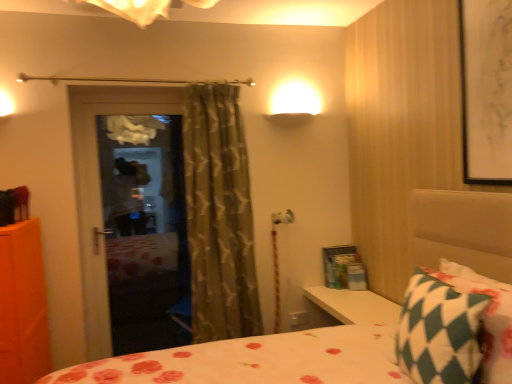
Question: From a real-world perspective, does green textured curtain at center sit lower than white paper at upper right?

Choices:
 (A) yes
 (B) no

Answer: (A)

Question: Can you confirm if green textured curtain at center is taller than white paper at upper right?

Choices:
 (A) no
 (B) yes

Answer: (B)

Question: From the image's perspective, is green textured curtain at center below white paper at upper right?

Choices:
 (A) no
 (B) yes

Answer: (B)

Question: Considering the relative positions of green textured curtain at center and white paper at upper right in the image provided, is green textured curtain at center to the right of white paper at upper right from the viewer's perspective?

Choices:
 (A) yes
 (B) no

Answer: (B)

Question: Does green textured curtain at center touch white paper at upper right?

Choices:
 (A) no
 (B) yes

Answer: (A)

Question: Considering the relative positions of green textured curtain at center and white paper at upper right in the image provided, is green textured curtain at center behind white paper at upper right?

Choices:
 (A) yes
 (B) no

Answer: (A)

Question: Considering the relative sizes of green checkered pillow at lower right and white paper at upper right in the image provided, is green checkered pillow at lower right wider than white paper at upper right?

Choices:
 (A) no
 (B) yes

Answer: (B)

Question: Is green checkered pillow at lower right looking in the opposite direction of white paper at upper right?

Choices:
 (A) no
 (B) yes

Answer: (A)

Question: Does green checkered pillow at lower right have a greater height compared to white paper at upper right?

Choices:
 (A) yes
 (B) no

Answer: (B)

Question: Is green checkered pillow at lower right at the right side of white paper at upper right?

Choices:
 (A) no
 (B) yes

Answer: (A)

Question: Are green checkered pillow at lower right and white paper at upper right far apart?

Choices:
 (A) yes
 (B) no

Answer: (B)

Question: Is white paper at upper right surrounded by green checkered pillow at lower right?

Choices:
 (A) yes
 (B) no

Answer: (B)

Question: Would you say white paper at upper right is outside green checkered pillow at lower right?

Choices:
 (A) yes
 (B) no

Answer: (A)